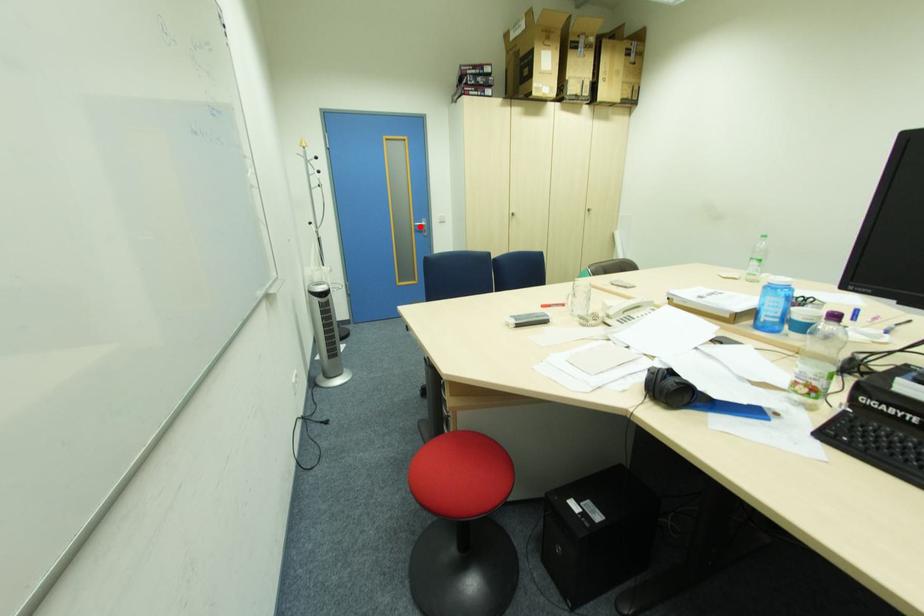
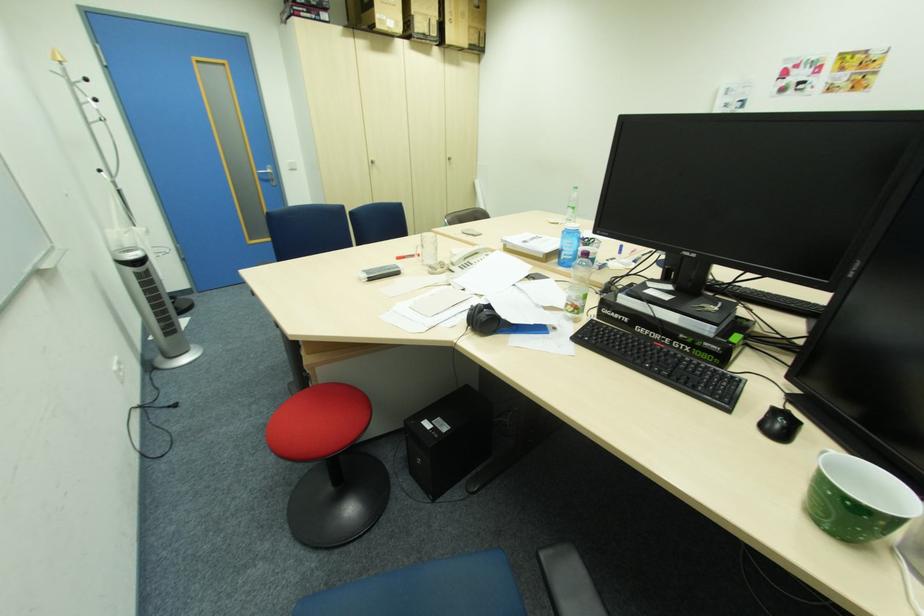
Locate, in the second image, the point that corresponds to the highlighted location in the first image.

(264, 174)